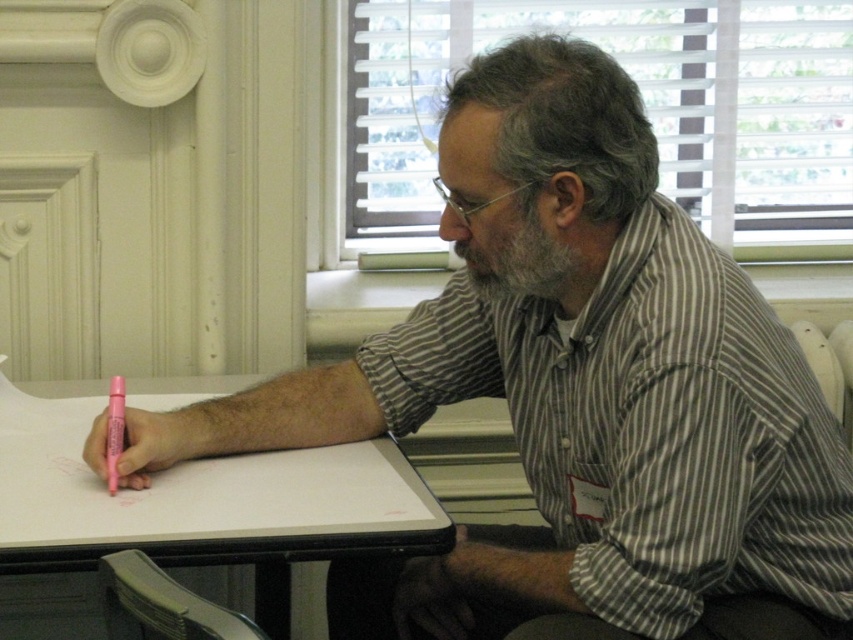
Question: Is striped cotton shirt at upper right to the left of pink plastic pen at lower left from the viewer's perspective?

Choices:
 (A) yes
 (B) no

Answer: (B)

Question: Does striped cotton shirt at upper right appear on the right side of white matte table at lower left?

Choices:
 (A) yes
 (B) no

Answer: (A)

Question: From the image, what is the correct spatial relationship of striped cotton shirt at upper right in relation to white matte table at lower left?

Choices:
 (A) left
 (B) right

Answer: (B)

Question: Which object is positioned farthest from the white matte table at lower left?

Choices:
 (A) pink plastic pen at lower left
 (B) striped cotton shirt at upper right

Answer: (B)

Question: Considering the real-world distances, which object is closest to the pink plastic pen at lower left?

Choices:
 (A) striped cotton shirt at upper right
 (B) white matte table at lower left

Answer: (B)

Question: Which of the following is the closest to the observer?

Choices:
 (A) white matte table at lower left
 (B) striped cotton shirt at upper right

Answer: (B)